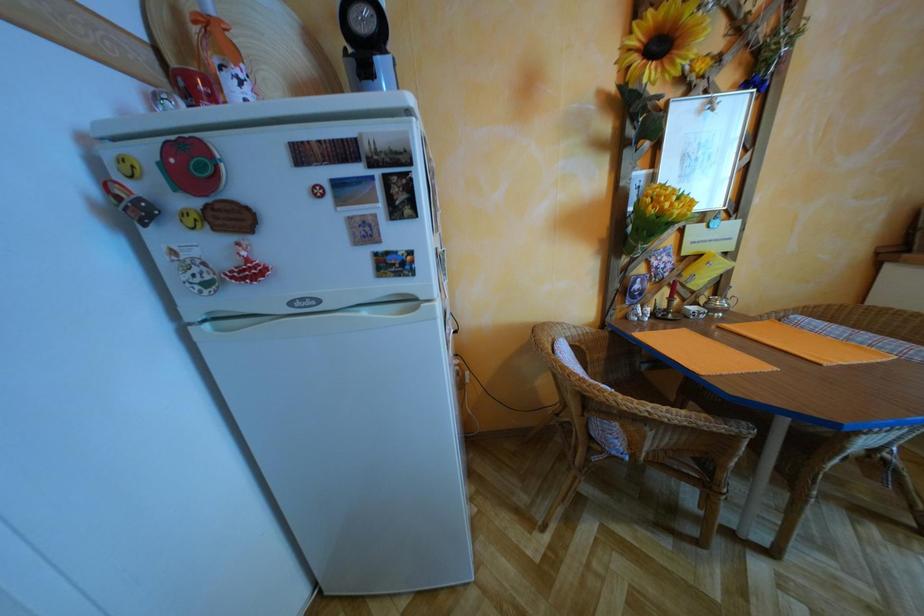
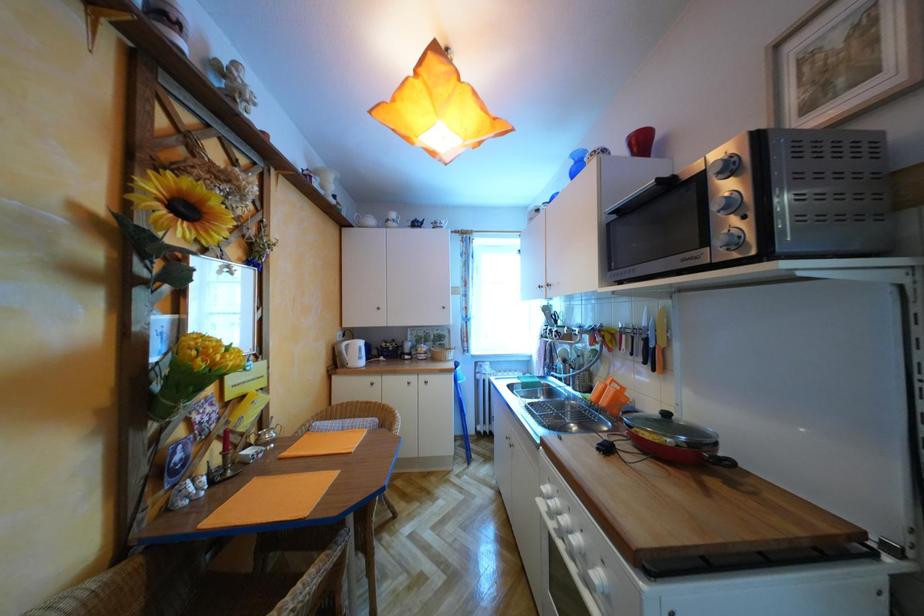
Question: The first image is from the beginning of the video and the second image is from the end. How did the camera likely rotate when shooting the video?

Choices:
 (A) Left
 (B) Right
 (C) Up
 (D) Down

Answer: (B)